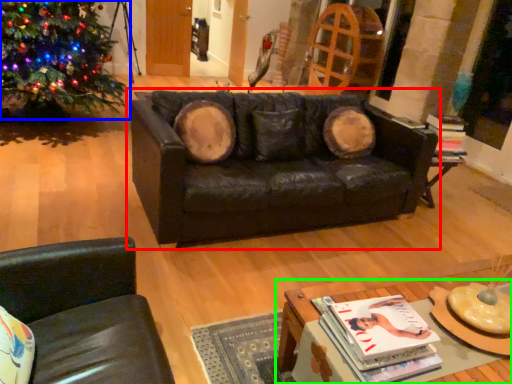
Question: Which object is positioned closest to studio couch (highlighted by a red box)? Select from christmas tree (highlighted by a blue box) and table (highlighted by a green box).

Choices:
 (A) christmas tree
 (B) table

Answer: (B)